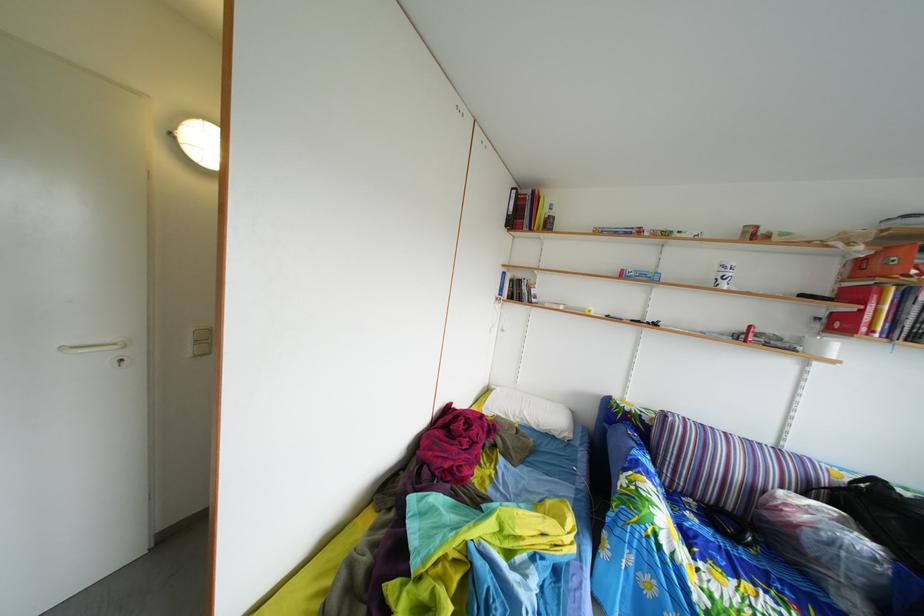
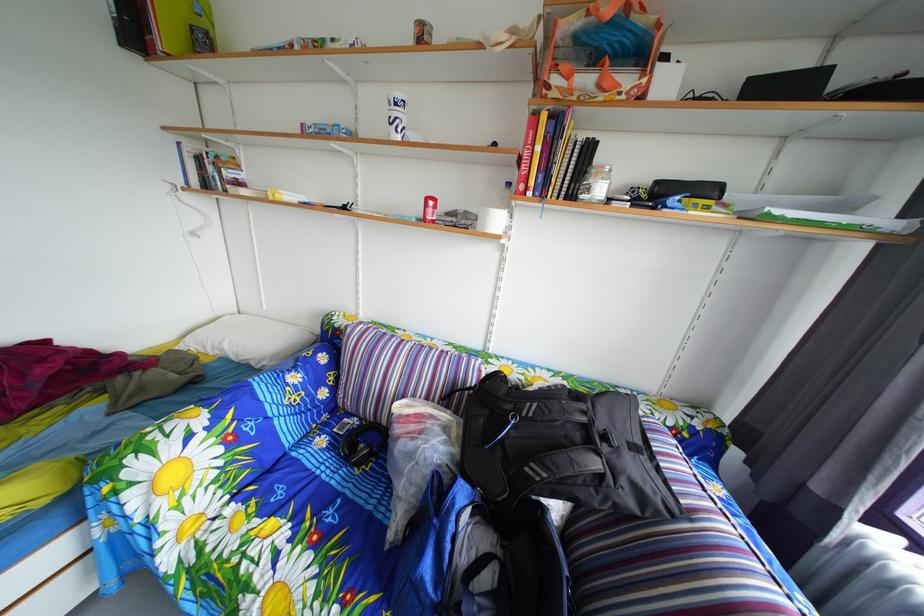
The point at (700, 509) is marked in the first image. Where is the corresponding point in the second image?

(367, 428)